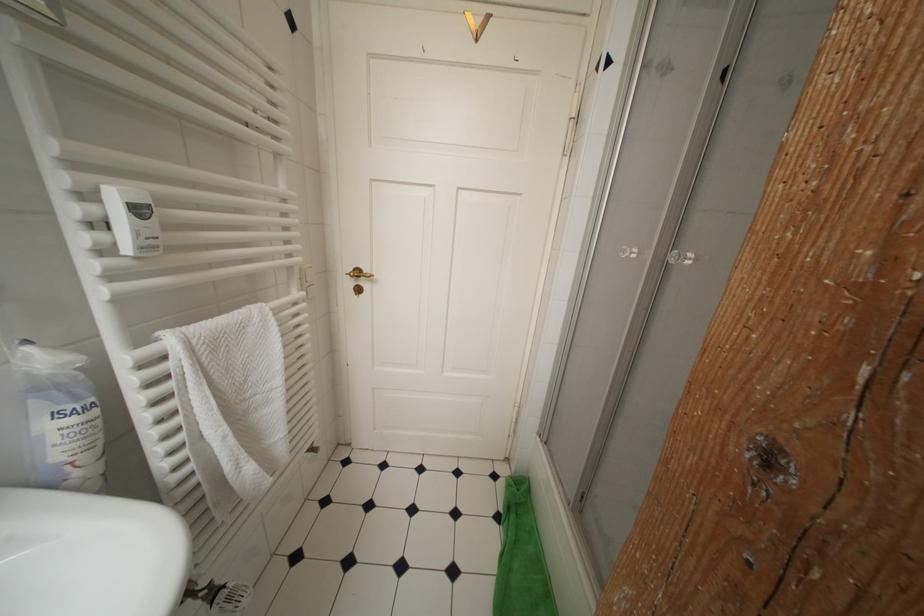
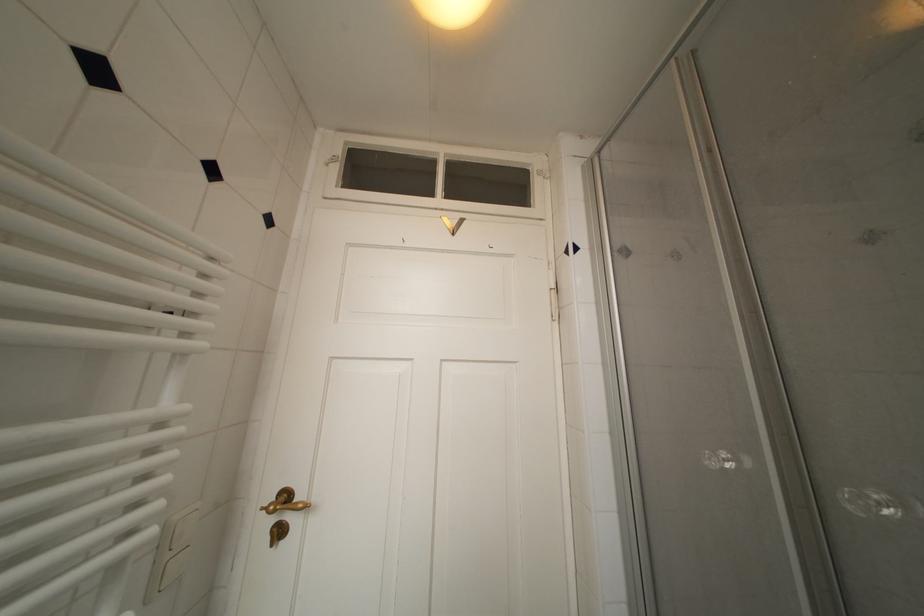
Question: How did the camera likely rotate?

Choices:
 (A) Left
 (B) Right
 (C) Up
 (D) Down

Answer: (C)